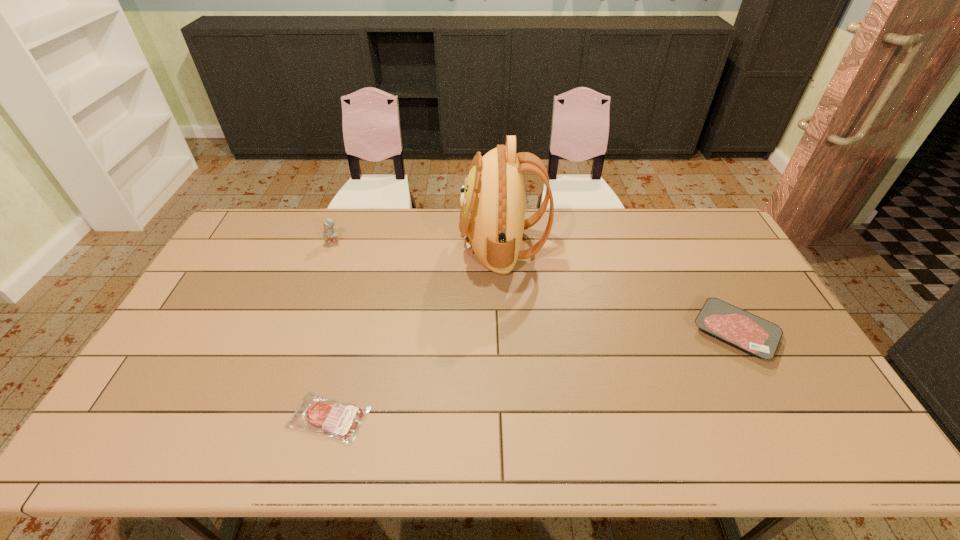
Locate an element on the screen. The width and height of the screenshot is (960, 540). vacant space that is in between the farther steak and the third shortest object is located at coordinates (534, 287).

Where is `free area in between the rightmost object and the backpack`? The width and height of the screenshot is (960, 540). free area in between the rightmost object and the backpack is located at coordinates (619, 289).

The width and height of the screenshot is (960, 540). In order to click on vacant area that lies between the second tallest object and the shortest object in this screenshot , I will do `click(331, 330)`.

Locate which object is the third closest to the tallest object. Please provide its 2D coordinates. Your answer should be formatted as a tuple, i.e. [(x, y)], where the tuple contains the x and y coordinates of a point satisfying the conditions above.

[(340, 421)]

Locate an element on the screen. The width and height of the screenshot is (960, 540). object that is the second closest to the second object from right to left is located at coordinates (330, 235).

Where is `vacant region that satisfies the following two spatial constraints: 1. on the front-facing side of the second object from right to left; 2. on the back side of the farther steak`? vacant region that satisfies the following two spatial constraints: 1. on the front-facing side of the second object from right to left; 2. on the back side of the farther steak is located at coordinates (508, 333).

Identify the location of free space that satisfies the following two spatial constraints: 1. on the front-facing side of the teddy bear; 2. on the left side of the taller steak. Image resolution: width=960 pixels, height=540 pixels. (300, 333).

You are a GUI agent. You are given a task and a screenshot of the screen. Output one action in this format:
    pyautogui.click(x=<x>, y=<y>)
    Task: Click on the free point that satisfies the following two spatial constraints: 1. on the front-facing side of the tallest object; 2. on the front side of the nearer steak
    
    Given the screenshot: What is the action you would take?
    pyautogui.click(x=513, y=417)

The image size is (960, 540). Identify the location of vacant point that satisfies the following two spatial constraints: 1. on the back side of the third tallest object; 2. on the front-facing side of the backpack. (688, 245).

This screenshot has width=960, height=540. Find the location of `vacant space that satisfies the following two spatial constraints: 1. on the front-facing side of the tallest object; 2. on the right side of the second nearest object`. vacant space that satisfies the following two spatial constraints: 1. on the front-facing side of the tallest object; 2. on the right side of the second nearest object is located at coordinates (508, 333).